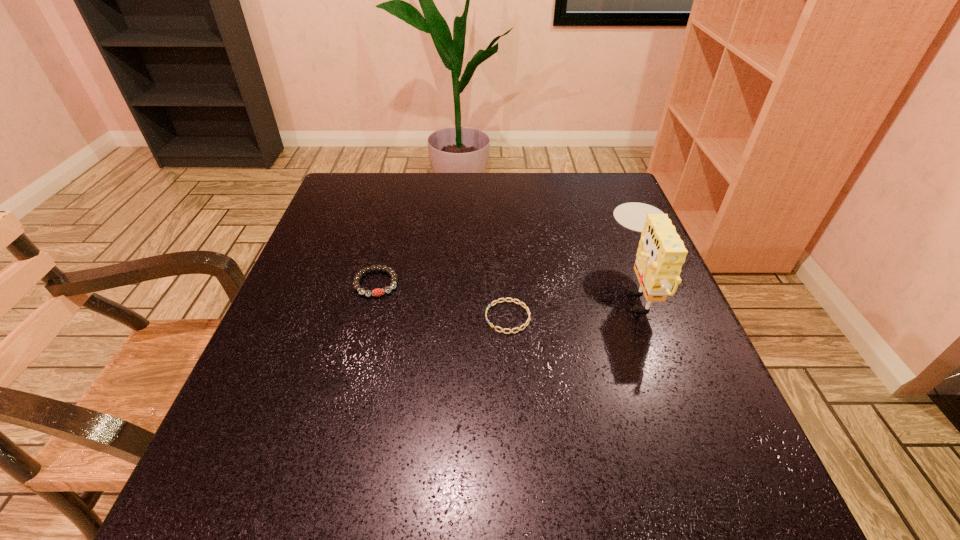
What are the coordinates of `unoccupied area between the right bracelet and the tallest object` in the screenshot? It's located at (573, 303).

Locate which object ranks in proximity to the rightmost object. Please provide its 2D coordinates. Your answer should be formatted as a tuple, i.e. [(x, y)], where the tuple contains the x and y coordinates of a point satisfying the conditions above.

[(512, 300)]

Identify which object is the second nearest to the second shortest object. Please provide its 2D coordinates. Your answer should be formatted as a tuple, i.e. [(x, y)], where the tuple contains the x and y coordinates of a point satisfying the conditions above.

[(661, 253)]